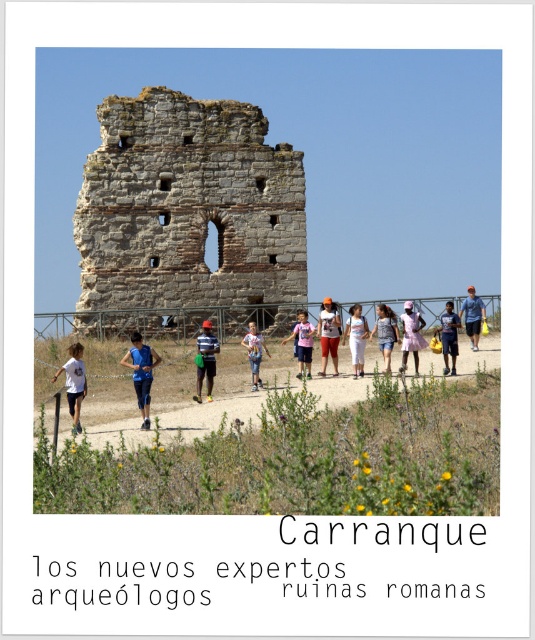
You are standing at the base of the weathered stone tower and want to reach the point marked as point [361,314]. There is an obstacle at point [80,396]. Can you walk directly to your destination without going around the obstacle?

Point [80,396] is in front of point [361,314], so you cannot walk directly to point [361,314] without going around the obstacle at point [80,396].